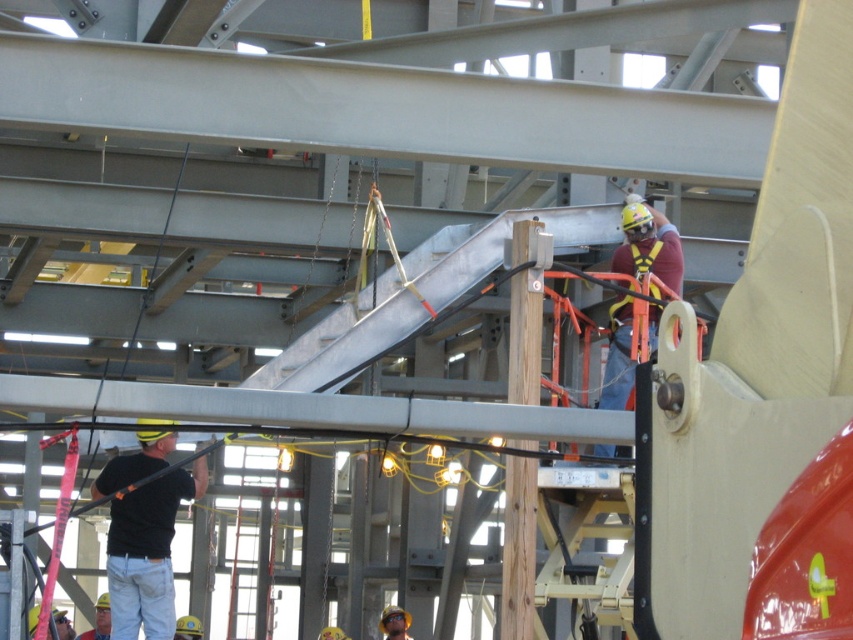
You are a safety inspector at the construction site. You need to ensure that the yellow safety harness at upper center is properly anchored to the metallic gray beam at center. Based on their positions, can you confirm if the harness is correctly attached to the beam?

The metallic gray beam at center is positioned on the left side of yellow safety harness at upper center. This means the harness is anchored to the beam, so it is correctly attached.